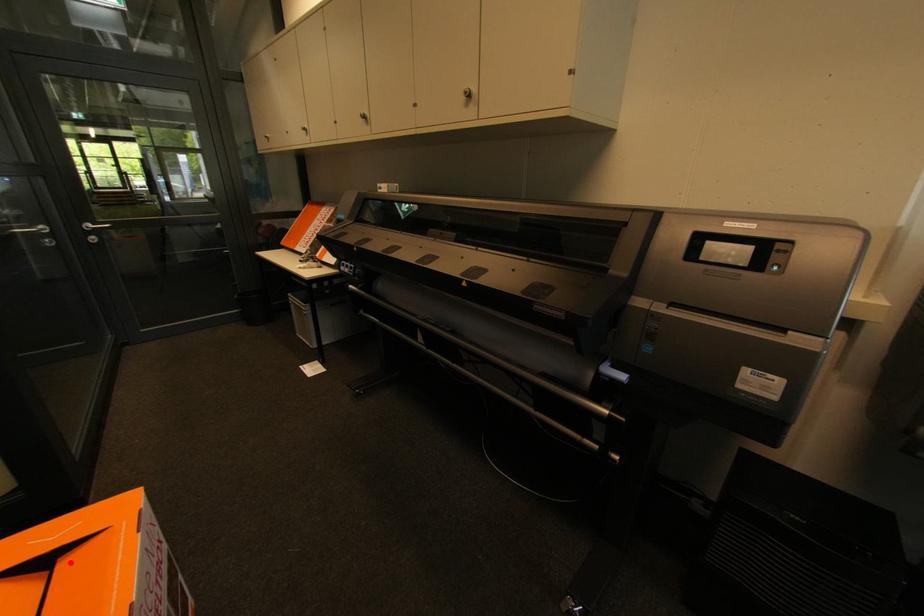
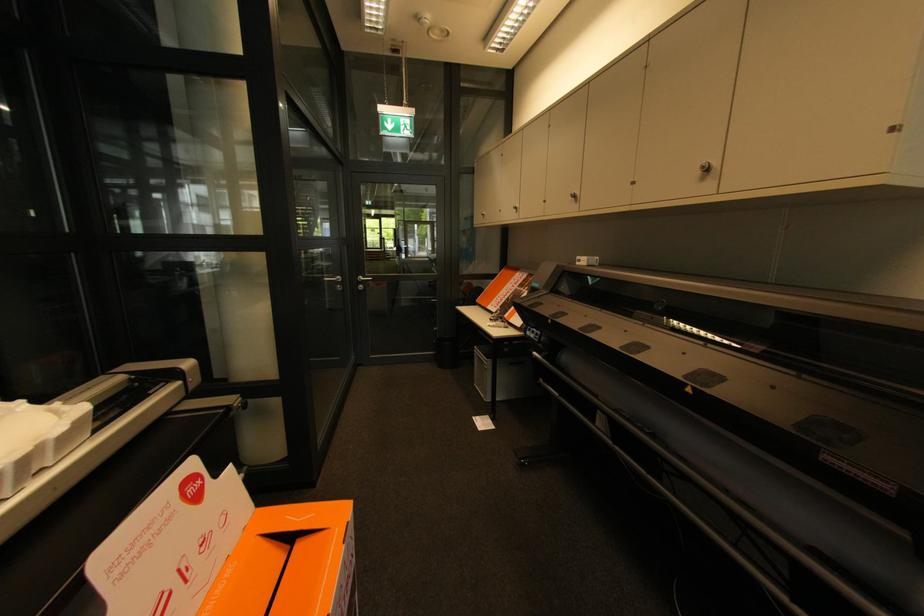
In the second image, find the point that corresponds to the highlighted location in the first image.

(304, 546)